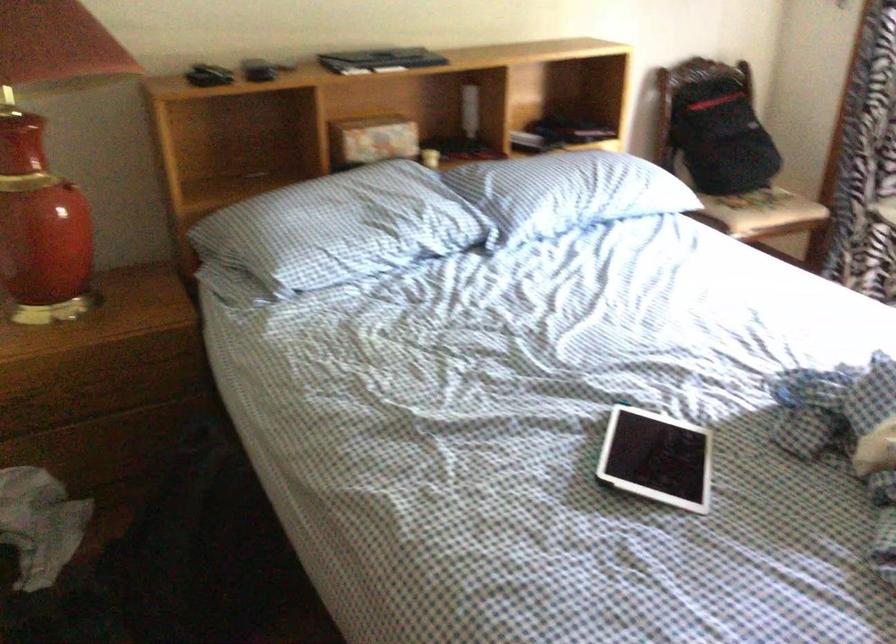
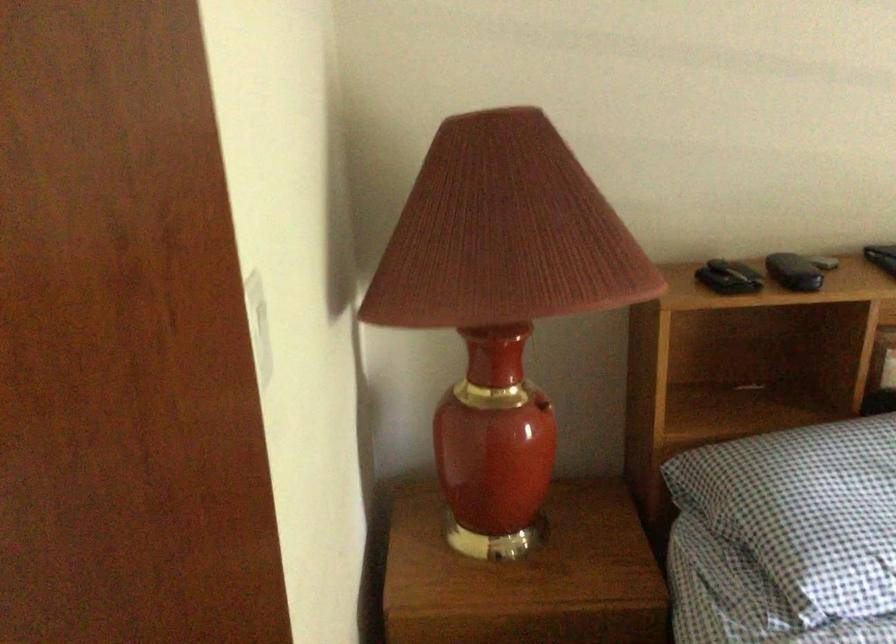
What movement of the cameraman would produce the second image?

The cameraman walked toward left, forward.